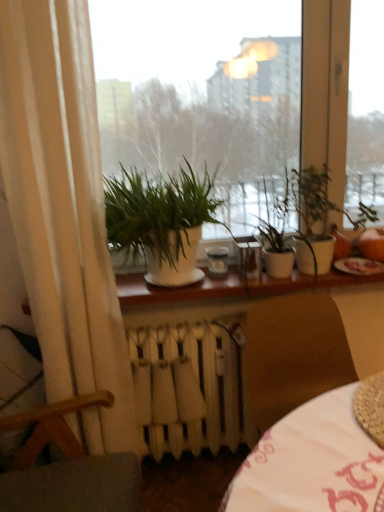
Question: Considering the positions of point (x=74, y=423) and point (x=334, y=440), is point (x=74, y=423) closer or farther from the camera than point (x=334, y=440)?

Choices:
 (A) closer
 (B) farther

Answer: (B)

Question: From the image's perspective, is white fabric curtain at left located above or below white fabric table at lower right?

Choices:
 (A) below
 (B) above

Answer: (B)

Question: Which object is the closest to the white fabric table at lower right?

Choices:
 (A) white metallic radiator at lower center
 (B) white fabric curtain at left
 (C) white glossy window at center
 (D) green matte plant at center, the first houseplant in the left-to-right sequence
 (E) white glossy window sill at center

Answer: (A)

Question: Which is nearer to the white glossy window at center?

Choices:
 (A) green matte plant at center, which ranks as the 2th houseplant in left-to-right order
 (B) wooden armchair at lower left
 (C) white metallic radiator at lower center
 (D) white glossy window sill at center
 (E) green matte plant at center, the first houseplant in the left-to-right sequence

Answer: (E)